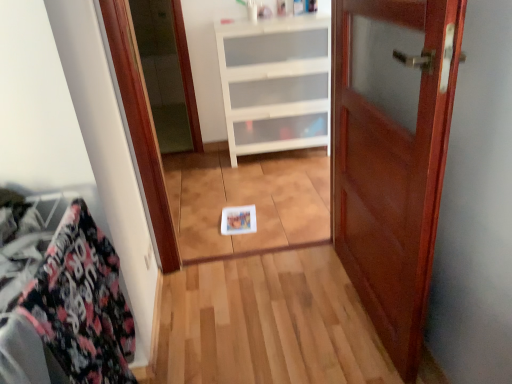
At what (x,y) coordinates should I click in order to perform the action: click on white plastic drawer at center. Please return your answer as a coordinate pair (x, y). Looking at the image, I should click on (275, 83).

Where is `floral fabric at left`? floral fabric at left is located at coordinates (63, 305).

Is white plastic drawer at center far from floral fabric at left?

Yes.

Considering the relative sizes of white plastic drawer at center and floral fabric at left in the image provided, is white plastic drawer at center bigger than floral fabric at left?

Indeed, white plastic drawer at center has a larger size compared to floral fabric at left.

Considering the sizes of white plastic drawer at center and floral fabric at left in the image, is white plastic drawer at center taller or shorter than floral fabric at left?

white plastic drawer at center is taller than floral fabric at left.

The width and height of the screenshot is (512, 384). In order to click on material positioned vertically above the white plastic drawer at center (from a real-world perspective) in this screenshot , I will do `click(63, 305)`.

Is mahogany wood door at center oriented towards floral fabric at left?

Yes, mahogany wood door at center is turned towards floral fabric at left.

How distant is mahogany wood door at center from floral fabric at left?

A distance of 37.90 inches exists between mahogany wood door at center and floral fabric at left.

Is mahogany wood door at center situated inside floral fabric at left or outside?

mahogany wood door at center cannot be found inside floral fabric at left.

You are a GUI agent. You are given a task and a screenshot of the screen. Output one action in this format:
    pyautogui.click(x=<x>, y=<y>)
    Task: Click on the door located above the floral fabric at left (from a real-world perspective)
    The height and width of the screenshot is (384, 512).
    Given the screenshot: What is the action you would take?
    pyautogui.click(x=392, y=171)

From a real-world perspective, is mahogany wood door at center over white plastic drawer at center?

Yes, from a real-world perspective, mahogany wood door at center is on top of white plastic drawer at center.

Based on their sizes in the image, would you say mahogany wood door at center is bigger or smaller than white plastic drawer at center?

Clearly, mahogany wood door at center is smaller in size than white plastic drawer at center.

Does mahogany wood door at center have a greater width compared to white plastic drawer at center?

No.

Is floral fabric at left to the left of white plastic drawer at center from the viewer's perspective?

Yes, floral fabric at left is to the left of white plastic drawer at center.

From a real-world perspective, which object stands above the other?

From a 3D spatial view, floral fabric at left is above.

In terms of size, does floral fabric at left appear bigger or smaller than white plastic drawer at center?

In the image, floral fabric at left appears to be smaller than white plastic drawer at center.

Is floral fabric at left outside of white plastic drawer at center?

Absolutely, floral fabric at left is external to white plastic drawer at center.

Based on the photo, considering the relative sizes of floral fabric at left and mahogany wood door at center in the image provided, is floral fabric at left smaller than mahogany wood door at center?

Yes.

Between point (70, 287) and point (390, 277), which one is positioned in front?

The point (70, 287) is closer to the camera.

Is floral fabric at left far away from mahogany wood door at center?

No, floral fabric at left is in close proximity to mahogany wood door at center.

Considering the sizes of objects floral fabric at left and mahogany wood door at center in the image provided, who is thinner, floral fabric at left or mahogany wood door at center?

A: Thinner between the two is mahogany wood door at center.

Where is `door positioned vertically above the white plastic drawer at center (from a real-world perspective)`? door positioned vertically above the white plastic drawer at center (from a real-world perspective) is located at coordinates (392, 171).

Is white plastic drawer at center taller or shorter than mahogany wood door at center?

white plastic drawer at center is shorter than mahogany wood door at center.

Who is bigger, white plastic drawer at center or mahogany wood door at center?

white plastic drawer at center is bigger.

Between point (253, 102) and point (443, 32), which one is positioned behind?

The point (253, 102) is farther.

In the image, there is a white plastic drawer at center. What are the coordinates of `material below it (from the image's perspective)` in the screenshot? It's located at (63, 305).

At what (x,y) coordinates should I click in order to perform the action: click on door lying on the right of floral fabric at left. Please return your answer as a coordinate pair (x, y). Looking at the image, I should click on (392, 171).

Considering their positions, is floral fabric at left positioned closer to mahogany wood door at center than white plastic drawer at center?

The object closer to mahogany wood door at center is floral fabric at left.

Which object lies nearer to the anchor point floral fabric at left, white plastic drawer at center or mahogany wood door at center?

Based on the image, mahogany wood door at center appears to be nearer to floral fabric at left.

When comparing their distances from white plastic drawer at center, does floral fabric at left or mahogany wood door at center seem closer?

mahogany wood door at center.

Looking at the image, which one is located further to floral fabric at left, mahogany wood door at center or white plastic drawer at center?

Based on the image, white plastic drawer at center appears to be further to floral fabric at left.

Consider the image. Which object lies further to the anchor point white plastic drawer at center, mahogany wood door at center or floral fabric at left?

The object further to white plastic drawer at center is floral fabric at left.

Estimate the real-world distances between objects in this image. Which object is further from mahogany wood door at center, white plastic drawer at center or floral fabric at left?

white plastic drawer at center is positioned further to the anchor mahogany wood door at center.

The image size is (512, 384). What are the coordinates of `door located between floral fabric at left and white plastic drawer at center in the depth direction` in the screenshot? It's located at (392, 171).